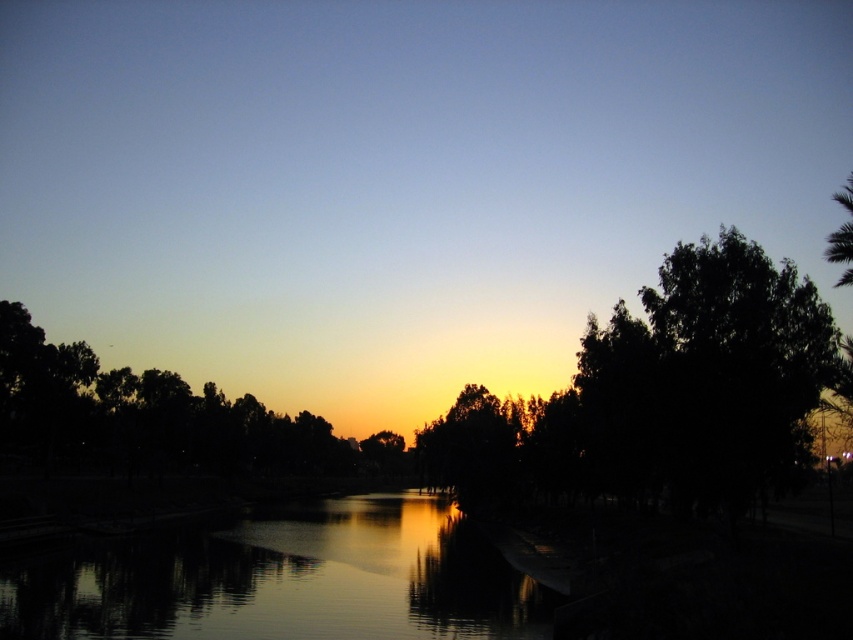
Question: Based on their relative distances, which object is farther from the dark green leafy tree at right?

Choices:
 (A) silky smooth water at center
 (B) green leafy tree at upper right

Answer: (B)

Question: Can you confirm if dark green leafy tree at right is positioned above green leafy tree at upper right?

Choices:
 (A) no
 (B) yes

Answer: (A)

Question: Is silky smooth water at center further to camera compared to green leafy tree at upper right?

Choices:
 (A) no
 (B) yes

Answer: (A)

Question: Can you confirm if dark green leafy tree at right is positioned to the right of green leafy tree at upper right?

Choices:
 (A) yes
 (B) no

Answer: (B)

Question: Which of the following is the farthest from the observer?

Choices:
 (A) dark green leafy tree at right
 (B) silky smooth water at center
 (C) green leafy tree at upper right

Answer: (A)

Question: Which object is closer to the camera taking this photo?

Choices:
 (A) dark green leafy tree at right
 (B) silky smooth water at center

Answer: (B)